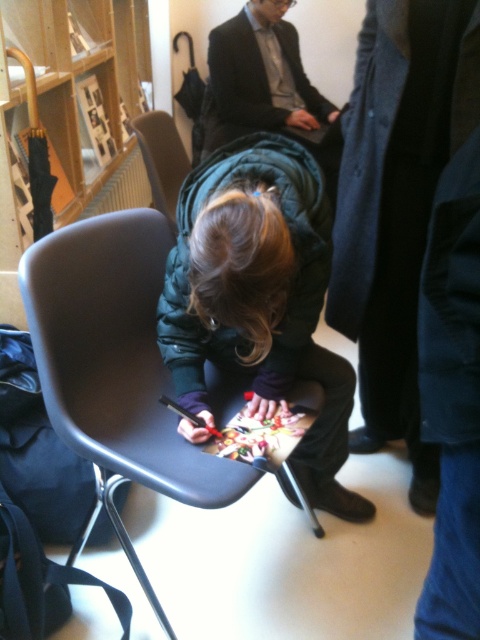
You are an event planner organizing a signing event. You need to ensure that the matte gray plastic chair at center and the matte gray chair at center are arranged properly. According to the scene description, how are these two chairs positioned relative to each other?

The matte gray plastic chair at center is positioned under the matte gray chair at center, meaning one is stacked on top of the other.

You are organizing a small event and need to seat guests. You have a matte gray plastic chair at center and a dark gray suit at upper center. Which object can accommodate a wider guest?

The dark gray suit at upper center can accommodate a wider guest since its width is greater than the matte gray plastic chair at center.